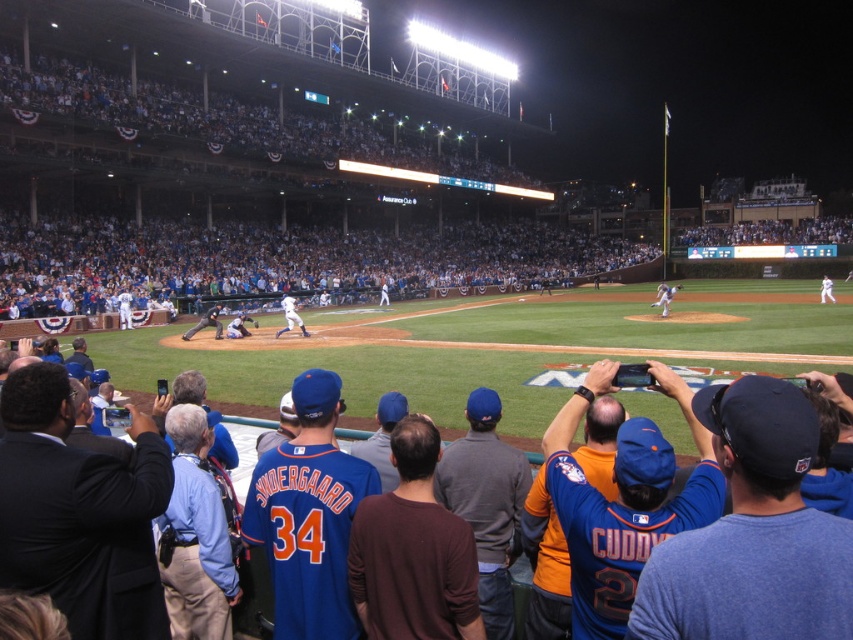
Can you confirm if white uniform pitcher at center is taller than blue jersey at center?

Yes, white uniform pitcher at center is taller than blue jersey at center.

Who is positioned more to the left, white uniform pitcher at center or blue jersey at center?

From the viewer's perspective, blue jersey at center appears more on the left side.

Find the location of a particular element. Image resolution: width=853 pixels, height=640 pixels. white uniform pitcher at center is located at coordinates (664, 296).